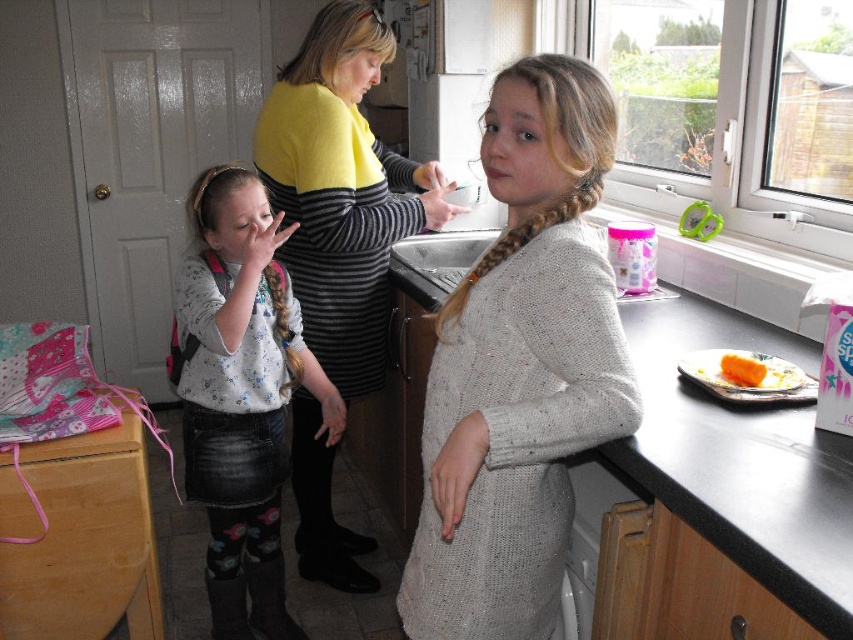
Which is below, knitted sweater at center or fluffy white sweater at center?

Positioned lower is fluffy white sweater at center.

Does knitted sweater at center appear on the right side of fluffy white sweater at center?

Correct, you'll find knitted sweater at center to the right of fluffy white sweater at center.

Locate an element on the screen. knitted sweater at center is located at coordinates (520, 369).

Can you confirm if fluffy white sweater at center is thinner than orange matte carrot at right?

No, fluffy white sweater at center is not thinner than orange matte carrot at right.

Is fluffy white sweater at center smaller than orange matte carrot at right?

No.

Which is behind, point (277, 561) or point (758, 368)?

The point (277, 561) is more distant.

You are a GUI agent. You are given a task and a screenshot of the screen. Output one action in this format:
    pyautogui.click(x=<x>, y=<y>)
    Task: Click on the fluffy white sweater at center
    This screenshot has height=640, width=853.
    Given the screenshot: What is the action you would take?
    pyautogui.click(x=241, y=396)

Can you confirm if yellow sweater at center is positioned above orange matte carrot at right?

Yes, yellow sweater at center is above orange matte carrot at right.

Does point (335, 332) lie in front of point (735, 384)?

No, it is not.

The width and height of the screenshot is (853, 640). Find the location of `yellow sweater at center`. yellow sweater at center is located at coordinates (341, 189).